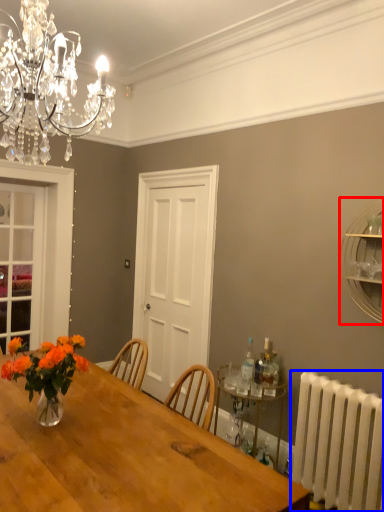
Question: Which object is further to the camera taking this photo, shelf (highlighted by a red box) or radiator (highlighted by a blue box)?

Choices:
 (A) shelf
 (B) radiator

Answer: (A)